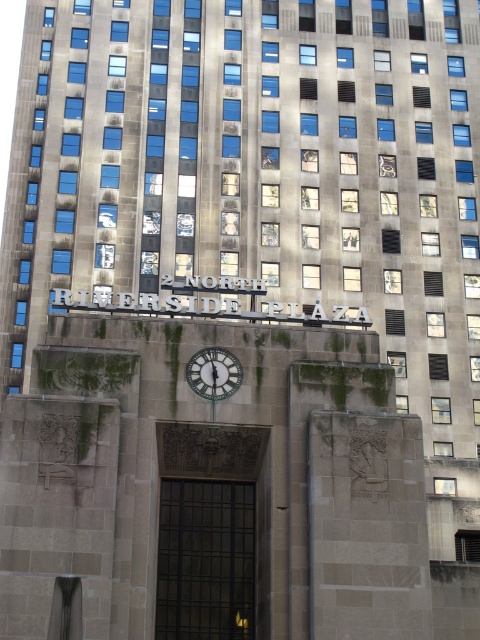
Does dark bronze door at center appear over metallic silver clock at center?

Incorrect, dark bronze door at center is not positioned above metallic silver clock at center.

Identify the location of dark bronze door at center. (206, 529).

I want to click on dark bronze door at center, so click(x=206, y=529).